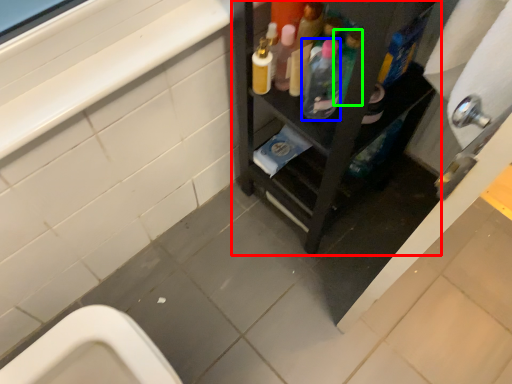
Question: Which object is positioned farthest from furniture (highlighted by a red box)? Select from bottle (highlighted by a blue box) and bottle (highlighted by a green box).

Choices:
 (A) bottle
 (B) bottle

Answer: (B)